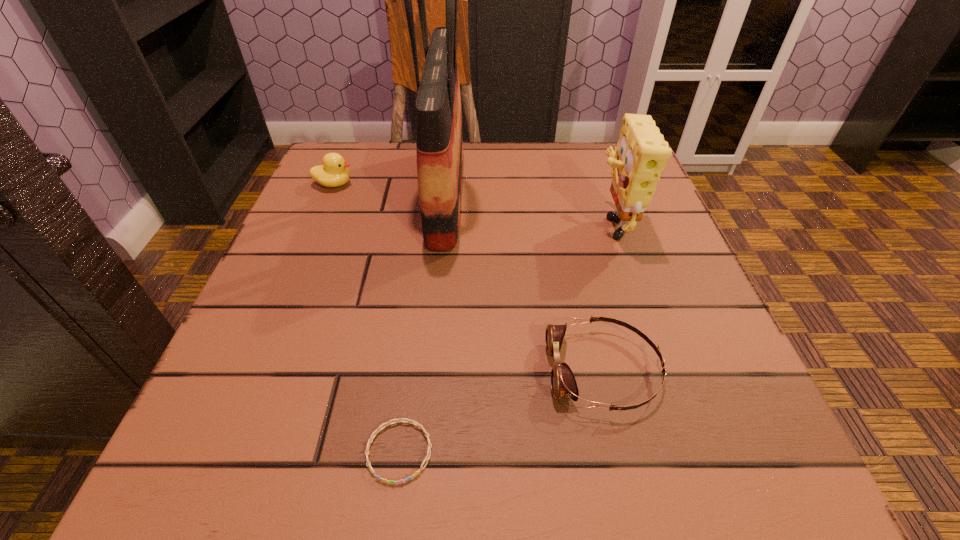
Locate an element on the screen. The width and height of the screenshot is (960, 540). shopping bag is located at coordinates coord(439,141).

I want to click on sponge, so click(x=641, y=154).

You are a GUI agent. You are given a task and a screenshot of the screen. Output one action in this format:
    pyautogui.click(x=<x>, y=<y>)
    Task: Click on the duckling
    
    Given the screenshot: What is the action you would take?
    pyautogui.click(x=333, y=173)

Find the location of a particular element. This screenshot has width=960, height=540. the leftmost object is located at coordinates (333, 173).

What are the coordinates of `goggles` in the screenshot? It's located at (563, 383).

This screenshot has height=540, width=960. Identify the location of the fourth tallest object. (563, 383).

Locate an element on the screen. the shortest object is located at coordinates (413, 422).

You are a GUI agent. You are given a task and a screenshot of the screen. Output one action in this format:
    pyautogui.click(x=<x>, y=<y>)
    Task: Click on the bracelet
    The height and width of the screenshot is (540, 960).
    Given the screenshot: What is the action you would take?
    pyautogui.click(x=413, y=422)

Locate an element on the screen. The width and height of the screenshot is (960, 540). vacant area situated on the front-facing side of the tallest object is located at coordinates (602, 194).

Locate an element on the screen. vacant space located on the face of the fourth shortest object is located at coordinates (433, 222).